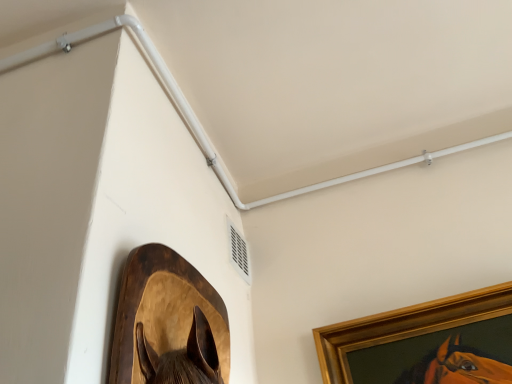
Question: Is white plastic pipe at upper center in front of white plastic air conditioning unit at upper center?

Choices:
 (A) no
 (B) yes

Answer: (A)

Question: Is white plastic pipe at upper center completely or partially outside of white plastic air conditioning unit at upper center?

Choices:
 (A) no
 (B) yes

Answer: (B)

Question: From a real-world perspective, is white plastic pipe at upper center on white plastic air conditioning unit at upper center?

Choices:
 (A) yes
 (B) no

Answer: (A)

Question: Can you confirm if white plastic pipe at upper center is shorter than white plastic air conditioning unit at upper center?

Choices:
 (A) no
 (B) yes

Answer: (B)

Question: Is white plastic pipe at upper center thinner than white plastic air conditioning unit at upper center?

Choices:
 (A) yes
 (B) no

Answer: (B)

Question: Could you tell me if white plastic pipe at upper center is turned towards white plastic air conditioning unit at upper center?

Choices:
 (A) no
 (B) yes

Answer: (A)

Question: Considering the relative positions of wooden horse head at lower left, acting as the first picture frame starting from the left, and gold wooden picture frame at upper right, acting as the first picture frame starting from the right, in the image provided, is wooden horse head at lower left, acting as the first picture frame starting from the left, in front of gold wooden picture frame at upper right, acting as the first picture frame starting from the right,?

Choices:
 (A) yes
 (B) no

Answer: (A)

Question: Is wooden horse head at lower left, acting as the first picture frame starting from the left, at the left side of gold wooden picture frame at upper right, arranged as the first picture frame when viewed from the back?

Choices:
 (A) yes
 (B) no

Answer: (A)

Question: Is wooden horse head at lower left, which is the second picture frame in back-to-front order, shorter than gold wooden picture frame at upper right, the second picture frame positioned from the left?

Choices:
 (A) yes
 (B) no

Answer: (A)

Question: From a real-world perspective, is wooden horse head at lower left, which is the second picture frame in back-to-front order, on top of gold wooden picture frame at upper right, arranged as the first picture frame when viewed from the back?

Choices:
 (A) no
 (B) yes

Answer: (A)

Question: Is wooden horse head at lower left, marked as the first picture frame in a front-to-back arrangement, behind gold wooden picture frame at upper right, acting as the first picture frame starting from the right?

Choices:
 (A) yes
 (B) no

Answer: (B)

Question: Can you confirm if wooden horse head at lower left, marked as the first picture frame in a front-to-back arrangement, is wider than gold wooden picture frame at upper right, arranged as the first picture frame when viewed from the back?

Choices:
 (A) no
 (B) yes

Answer: (B)

Question: From a real-world perspective, is white plastic pipe at upper center below gold wooden picture frame at upper right, the second picture frame positioned from the left?

Choices:
 (A) no
 (B) yes

Answer: (A)